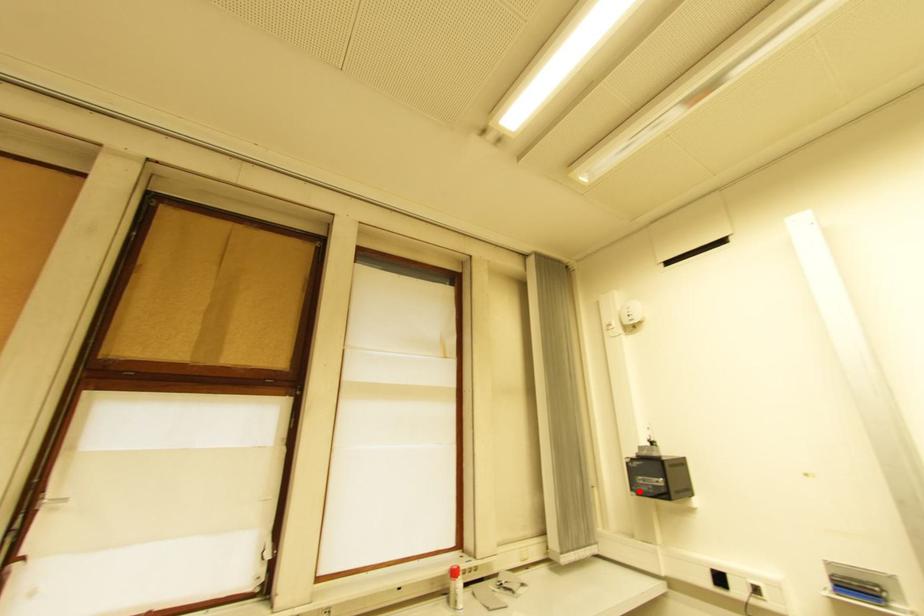
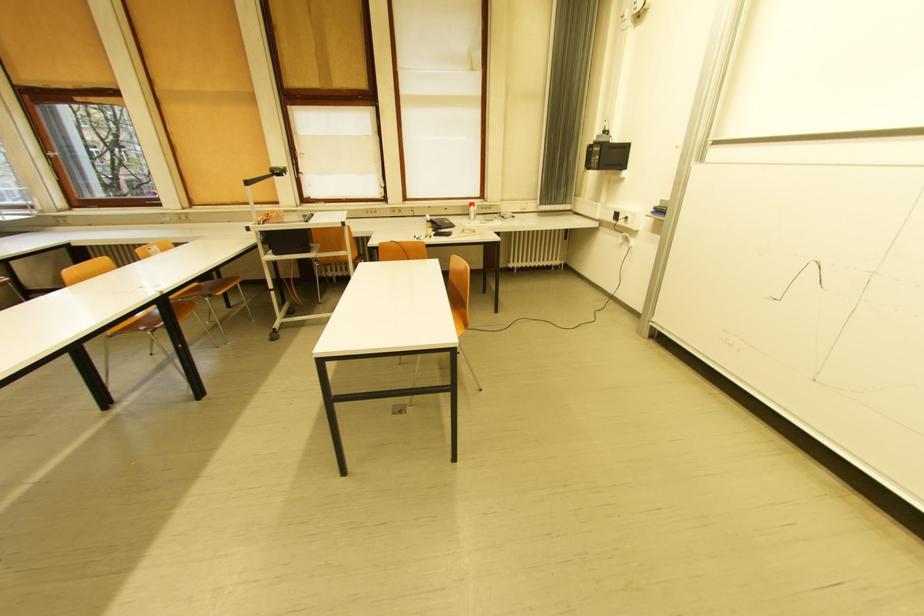
Question: A red point is marked in image1. In image2, is the corresponding 3D point closer to the camera or farther? Reply with the corresponding letter.

Choices:
 (A) The corresponding 3D point is closer.
 (B) The corresponding 3D point is farther.

Answer: (A)